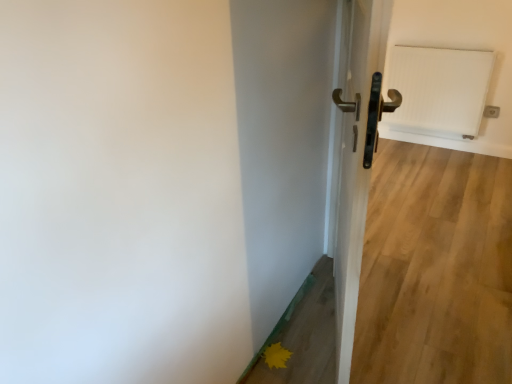
Identify the location of vacant area on top of white textured radiator at upper right (from a real-world perspective). (444, 46).